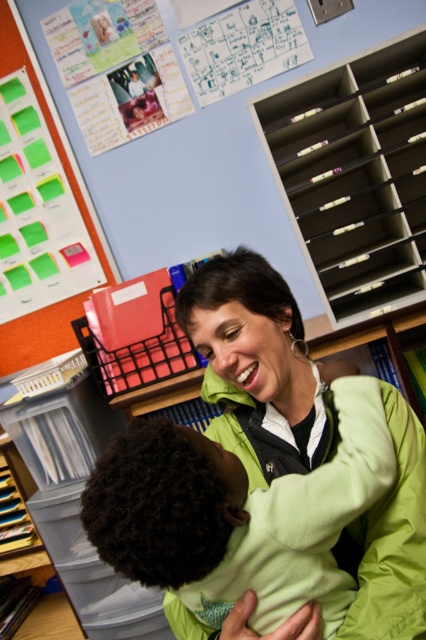
Can you confirm if green fleece jacket at center is thinner than gray plastic bookshelf at upper right?

Indeed, green fleece jacket at center has a lesser width compared to gray plastic bookshelf at upper right.

Is point (334, 436) less distant than point (302, 237)?

Yes, it is in front of point (302, 237).

Which is behind, point (423, 477) or point (396, 198)?

The point (396, 198) is behind.

Where is `green fleece jacket at center`? green fleece jacket at center is located at coordinates (258, 368).

Which of these two, gray plastic bookshelf at upper right or green sticky notes at upper left, stands taller?

green sticky notes at upper left

Is point (374, 202) positioned after point (20, 65)?

No, (374, 202) is in front of (20, 65).

Identify the location of gray plastic bookshelf at upper right. (356, 177).

Which of these two, green fleece jacket at center or green sticky notes at upper left, stands taller?

Standing taller between the two is green sticky notes at upper left.

Who is more forward, (241, 348) or (16, 342)?

Point (241, 348) is more forward.

Measure the distance between point (x=222, y=278) and camera.

37.03 inches

Where is `green fleece jacket at center`? The width and height of the screenshot is (426, 640). green fleece jacket at center is located at coordinates (258, 368).